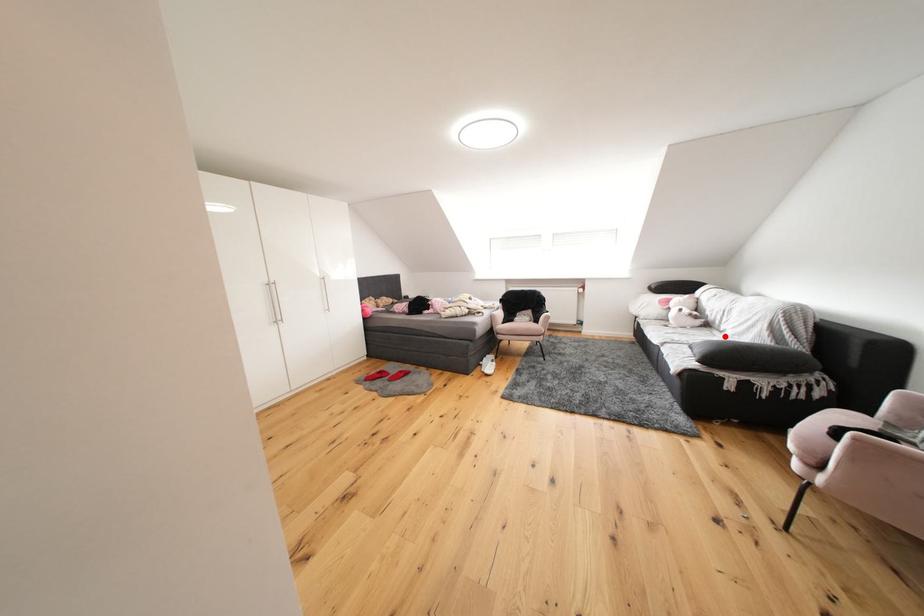
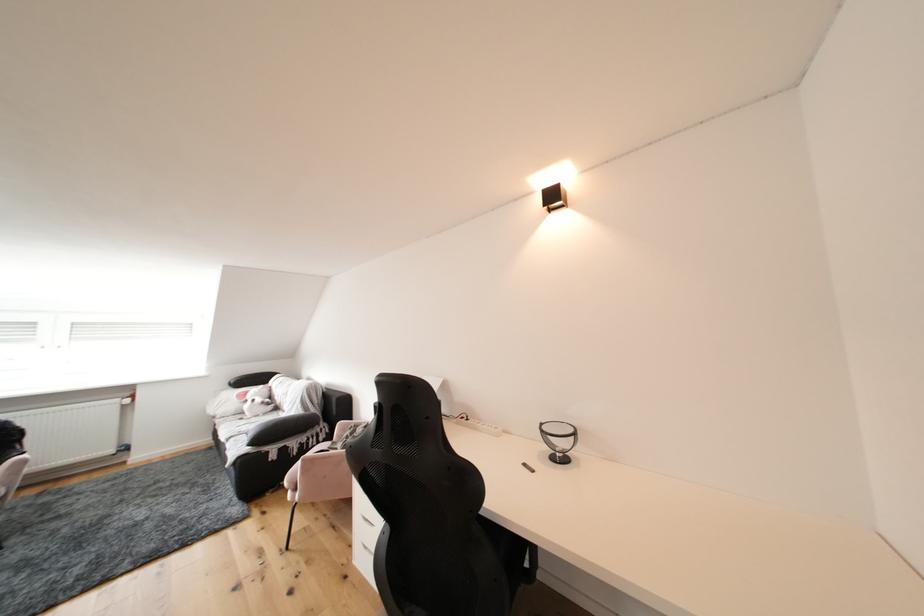
Question: I am providing you with two images of the same scene from different viewpoints. A red point is marked on the first image. Can you still see the location of the red point in image 2?

Choices:
 (A) Yes
 (B) No

Answer: (A)